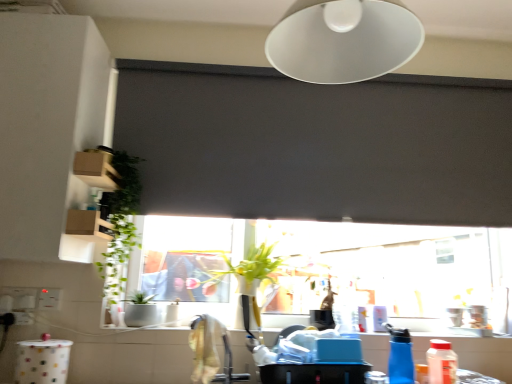
Based on the photo, in order to face translucent plastic bottle at lower right, the 1th bottle viewed from the right, should I rotate leftwards or rightwards?

Turn right approximately 24.009 degrees to face it.

At what (x,y) coordinates should I click in order to perform the action: click on transparent glass window at center. Please return your answer as a coordinate pair (x, y). Looking at the image, I should click on (329, 268).

This screenshot has width=512, height=384. What do you see at coordinates (49, 299) in the screenshot?
I see `white plastic electric outlet at lower left` at bounding box center [49, 299].

Locate an element on the screen. Image resolution: width=512 pixels, height=384 pixels. white plastic electric outlet at lower left is located at coordinates (49, 299).

Identify the location of blue plastic bottle at lower right, arranged as the 1th bottle when viewed from the left. The width and height of the screenshot is (512, 384). (400, 356).

What do you see at coordinates (140, 310) in the screenshot? I see `white ceramic sink at window` at bounding box center [140, 310].

The width and height of the screenshot is (512, 384). Identify the location of white matte lampshade at upper center. coord(343,40).

Image resolution: width=512 pixels, height=384 pixels. What do you see at coordinates (317, 145) in the screenshot? I see `dark matte window screen at center` at bounding box center [317, 145].

Find the location of a particular element. The height and width of the screenshot is (384, 512). translucent plastic bottle at lower right, the 1th bottle viewed from the right is located at coordinates (441, 362).

Is blue plastic bottle at lower right, positioned as the second bottle in right-to-left order, not close to dark matte window screen at center?

No.

From a real-world perspective, is blue plastic bottle at lower right, arranged as the 1th bottle when viewed from the left, above or below dark matte window screen at center?

blue plastic bottle at lower right, arranged as the 1th bottle when viewed from the left, is situated lower than dark matte window screen at center in the real world.

Would you say blue plastic bottle at lower right, positioned as the second bottle in right-to-left order, is inside or outside dark matte window screen at center?

blue plastic bottle at lower right, positioned as the second bottle in right-to-left order, cannot be found inside dark matte window screen at center.

Is white matte lampshade at upper center in front of or behind translucent plastic bottle at lower right, the 1th bottle viewed from the right, in the image?

Visually, white matte lampshade at upper center is located in front of translucent plastic bottle at lower right, the 1th bottle viewed from the right.

From a real-world perspective, is white matte lampshade at upper center on translucent plastic bottle at lower right, the 1th bottle viewed from the right?

Yes, from a real-world perspective, white matte lampshade at upper center is over translucent plastic bottle at lower right, the 1th bottle viewed from the right

Considering the relative sizes of white matte lampshade at upper center and translucent plastic bottle at lower right, which is the second bottle from left to right, in the image provided, is white matte lampshade at upper center thinner than translucent plastic bottle at lower right, which is the second bottle from left to right,?

No, white matte lampshade at upper center is not thinner than translucent plastic bottle at lower right, which is the second bottle from left to right.

Are white matte lampshade at upper center and translucent plastic bottle at lower right, the 1th bottle viewed from the right, located far from each other?

Yes.

Where is `window screen above the white plastic electric outlet at lower left (from a real-world perspective)`? The height and width of the screenshot is (384, 512). window screen above the white plastic electric outlet at lower left (from a real-world perspective) is located at coordinates (317, 145).

In the image, is dark matte window screen at center on the left side or the right side of white plastic electric outlet at lower left?

Based on their positions, dark matte window screen at center is located to the right of white plastic electric outlet at lower left.

Is white plastic electric outlet at lower left at the back of dark matte window screen at center?

dark matte window screen at center does not have its back to white plastic electric outlet at lower left.

Which point is more distant from viewer, (497, 312) or (301, 135)?

The point (301, 135) is farther from the camera.

From a real-world perspective, is transparent glass window at center beneath dark matte window screen at center?

Yes.

Is transparent glass window at center next to dark matte window screen at center?

No, transparent glass window at center is not making contact with dark matte window screen at center.

Which object is wider, transparent glass window at center or dark matte window screen at center?

Wider between the two is transparent glass window at center.

Is translucent plastic bottle at lower right, the 1th bottle viewed from the right, spatially inside white plastic electric outlet at lower left, or outside of it?

translucent plastic bottle at lower right, the 1th bottle viewed from the right, cannot be found inside white plastic electric outlet at lower left.

Consider the image. Who is taller, translucent plastic bottle at lower right, the 1th bottle viewed from the right, or white plastic electric outlet at lower left?

With more height is translucent plastic bottle at lower right, the 1th bottle viewed from the right.

Which object is closer to the camera, translucent plastic bottle at lower right, which is the second bottle from left to right, or white plastic electric outlet at lower left?

Positioned in front is translucent plastic bottle at lower right, which is the second bottle from left to right.

Does translucent plastic bottle at lower right, the 1th bottle viewed from the right, have a larger size compared to white plastic electric outlet at lower left?

Yes, translucent plastic bottle at lower right, the 1th bottle viewed from the right, is bigger than white plastic electric outlet at lower left.

From the image's perspective, is transparent glass window at center beneath blue plastic bottle at lower right, arranged as the 1th bottle when viewed from the left?

No, from the image's perspective, transparent glass window at center is not below blue plastic bottle at lower right, arranged as the 1th bottle when viewed from the left.

Could you tell me if transparent glass window at center is facing blue plastic bottle at lower right, positioned as the second bottle in right-to-left order?

No, transparent glass window at center is not aimed at blue plastic bottle at lower right, positioned as the second bottle in right-to-left order.

Which object is closer to the camera taking this photo, transparent glass window at center or blue plastic bottle at lower right, arranged as the 1th bottle when viewed from the left?

Positioned in front is blue plastic bottle at lower right, arranged as the 1th bottle when viewed from the left.

Could you tell me if white plastic electric outlet at lower left is turned towards blue plastic bottle at lower right, positioned as the second bottle in right-to-left order?

No, white plastic electric outlet at lower left is not turned towards blue plastic bottle at lower right, positioned as the second bottle in right-to-left order.

Measure the distance from white plastic electric outlet at lower left to blue plastic bottle at lower right, positioned as the second bottle in right-to-left order.

white plastic electric outlet at lower left is 4.45 feet away from blue plastic bottle at lower right, positioned as the second bottle in right-to-left order.

From the image's perspective, does white plastic electric outlet at lower left appear lower than blue plastic bottle at lower right, positioned as the second bottle in right-to-left order?

No.

Can you confirm if white plastic electric outlet at lower left is shorter than blue plastic bottle at lower right, arranged as the 1th bottle when viewed from the left?

Correct, white plastic electric outlet at lower left is not as tall as blue plastic bottle at lower right, arranged as the 1th bottle when viewed from the left.

Identify the location of window screen located above the blue plastic bottle at lower right, positioned as the second bottle in right-to-left order (from a real-world perspective). (317, 145).

This screenshot has height=384, width=512. In order to click on bottle that is the 2nd one when counting rightward from the white matte lampshade at upper center in this screenshot , I will do `click(441, 362)`.

When comparing their distances from white plastic electric outlet at lower left, does white matte lampshade at upper center or dark matte window screen at center seem further?

The object further to white plastic electric outlet at lower left is white matte lampshade at upper center.

Based on their spatial positions, is blue plastic bottle at lower right, positioned as the second bottle in right-to-left order, or dark matte window screen at center closer to white ceramic sink at window?

dark matte window screen at center lies closer to white ceramic sink at window than the other object.

Looking at the image, which one is located closer to white ceramic sink at window, dark matte window screen at center or blue plastic bottle at lower right, positioned as the second bottle in right-to-left order?

Based on the image, dark matte window screen at center appears to be nearer to white ceramic sink at window.

Considering their positions, is white ceramic sink at window positioned further to transparent glass window at center than white matte lampshade at upper center?

Based on the image, white matte lampshade at upper center appears to be further to transparent glass window at center.

Estimate the real-world distances between objects in this image. Which object is closer to white ceramic sink at window, white matte lampshade at upper center or translucent plastic bottle at lower right, the 1th bottle viewed from the right?

Among the two, translucent plastic bottle at lower right, the 1th bottle viewed from the right, is located nearer to white ceramic sink at window.

From the image, which object appears to be farther from transparent glass window at center, blue plastic bottle at lower right, positioned as the second bottle in right-to-left order, or white ceramic sink at window?

Based on the image, white ceramic sink at window appears to be further to transparent glass window at center.

When comparing their distances from white ceramic sink at window, does white matte lampshade at upper center or blue plastic bottle at lower right, arranged as the 1th bottle when viewed from the left, seem further?

white matte lampshade at upper center is further to white ceramic sink at window.

Estimate the real-world distances between objects in this image. Which object is further from blue plastic bottle at lower right, arranged as the 1th bottle when viewed from the left, translucent plastic bottle at lower right, which is the second bottle from left to right, or white plastic electric outlet at lower left?

white plastic electric outlet at lower left is positioned further to the anchor blue plastic bottle at lower right, arranged as the 1th bottle when viewed from the left.

This screenshot has height=384, width=512. I want to click on window between dark matte window screen at center and blue plastic bottle at lower right, positioned as the second bottle in right-to-left order, in the vertical direction, so click(329, 268).

Identify the location of window situated between white ceramic sink at window and blue plastic bottle at lower right, arranged as the 1th bottle when viewed from the left, from left to right. Image resolution: width=512 pixels, height=384 pixels. (329, 268).

Where is `sink between white matte lampshade at upper center and translucent plastic bottle at lower right, which is the second bottle from left to right, in the vertical direction`? The image size is (512, 384). sink between white matte lampshade at upper center and translucent plastic bottle at lower right, which is the second bottle from left to right, in the vertical direction is located at coordinates (140, 310).

The width and height of the screenshot is (512, 384). I want to click on window screen between white ceramic sink at window and translucent plastic bottle at lower right, the 1th bottle viewed from the right, from left to right, so click(317, 145).